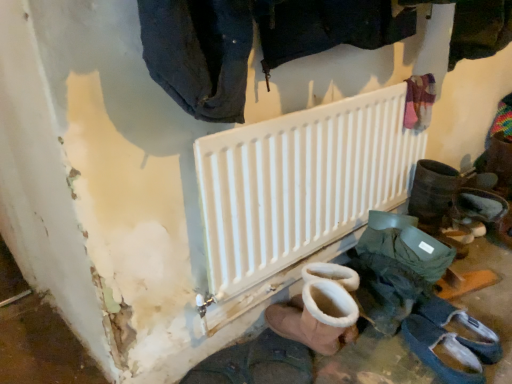
Question: From a real-world perspective, is brown suede boot at lower center, placed as the fourth footwear when sorted from right to left, physically located above or below white suede boot at lower center, which ranks as the 3th footwear in right-to-left order?

Choices:
 (A) above
 (B) below

Answer: (B)

Question: Does point (307, 311) appear closer or farther from the camera than point (360, 271)?

Choices:
 (A) farther
 (B) closer

Answer: (B)

Question: Which is farther from the dark blue denim jeans at upper center?

Choices:
 (A) white matte radiator at center
 (B) dark brown leather boot at lower center, which appears as the 5th footwear when viewed from the right
 (C) dark gray suede boot at lower right, which ranks as the fourth footwear in left-to-right order
 (D) white suede boot at lower center, the 3th footwear viewed from the left
 (E) dark gray suede shoes at lower right, which is counted as the fifth footwear, starting from the left

Answer: (E)

Question: Estimate the real-world distances between objects in this image. Which object is farther from the brown suede boot at lower center, which is counted as the 2th footwear, starting from the left?

Choices:
 (A) white matte radiator at center
 (B) white suede boot at lower center, which ranks as the 3th footwear in right-to-left order
 (C) dark blue denim jeans at upper center
 (D) dark brown leather boot at lower center, the first footwear in the left-to-right sequence
 (E) dark gray suede shoes at lower right, which is counted as the fifth footwear, starting from the left

Answer: (C)